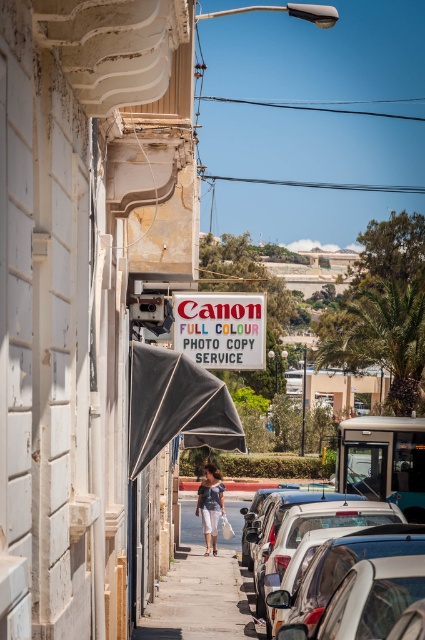
Find the location of a particular element. This screenshot has width=425, height=640. red plastic sign at center is located at coordinates (221, 328).

I want to click on red plastic sign at center, so click(221, 328).

Is the position of white matte signboard at center less distant than that of red plastic sign at center?

Yes, it is in front of red plastic sign at center.

How distant is white matte signboard at center from red plastic sign at center?

white matte signboard at center and red plastic sign at center are 30.35 feet apart.

Is point (91, 280) positioned behind point (201, 342)?

No.

Where is `white matte signboard at center`? This screenshot has width=425, height=640. white matte signboard at center is located at coordinates click(x=82, y=285).

Is gray concrete sidewalk at center shorter than denim shorts at center?

Incorrect, gray concrete sidewalk at center's height does not fall short of denim shorts at center's.

Locate an element on the screen. This screenshot has height=640, width=425. gray concrete sidewalk at center is located at coordinates pyautogui.click(x=201, y=588).

Image resolution: width=425 pixels, height=640 pixels. In order to click on gray concrete sidewalk at center in this screenshot , I will do `click(201, 588)`.